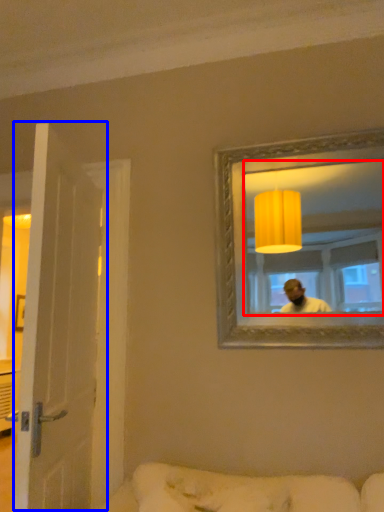
Question: Which of the following is the farthest to the observer, mirror (highlighted by a red box) or door (highlighted by a blue box)?

Choices:
 (A) mirror
 (B) door

Answer: (B)